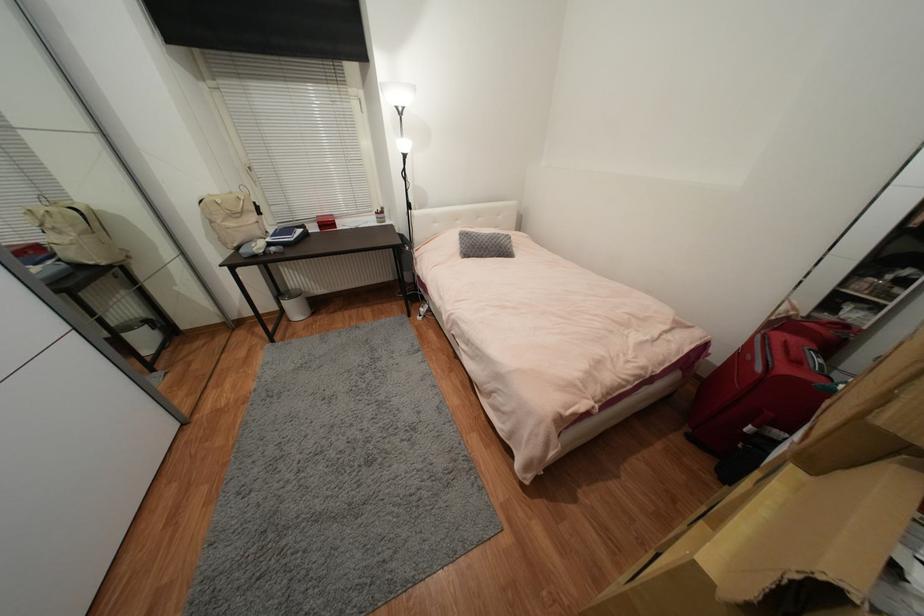
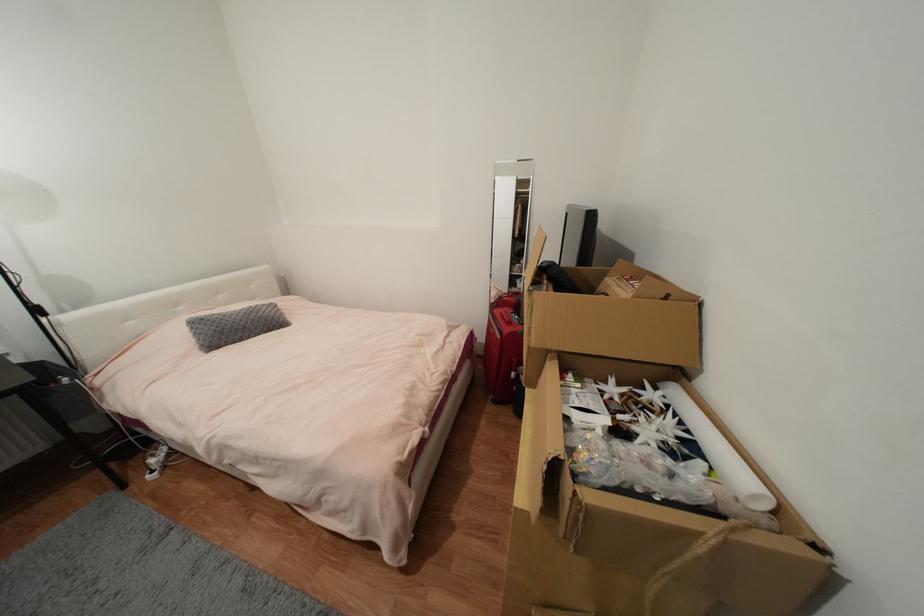
In the second image, find the point that corresponds to point 755,429 in the first image.

(517, 375)